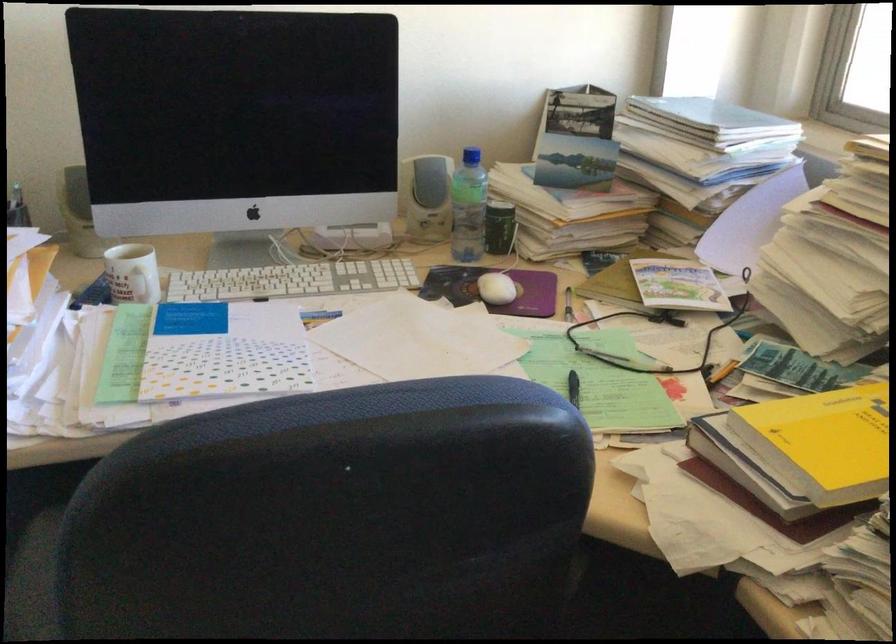
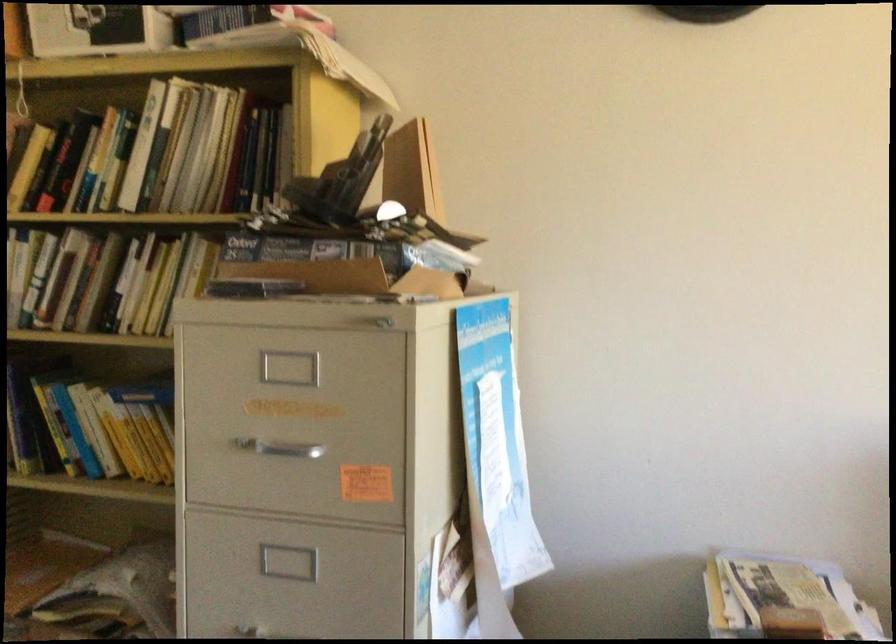
First-person continuous shooting, in which direction is the camera rotating?

The camera's rotation is toward left-up.